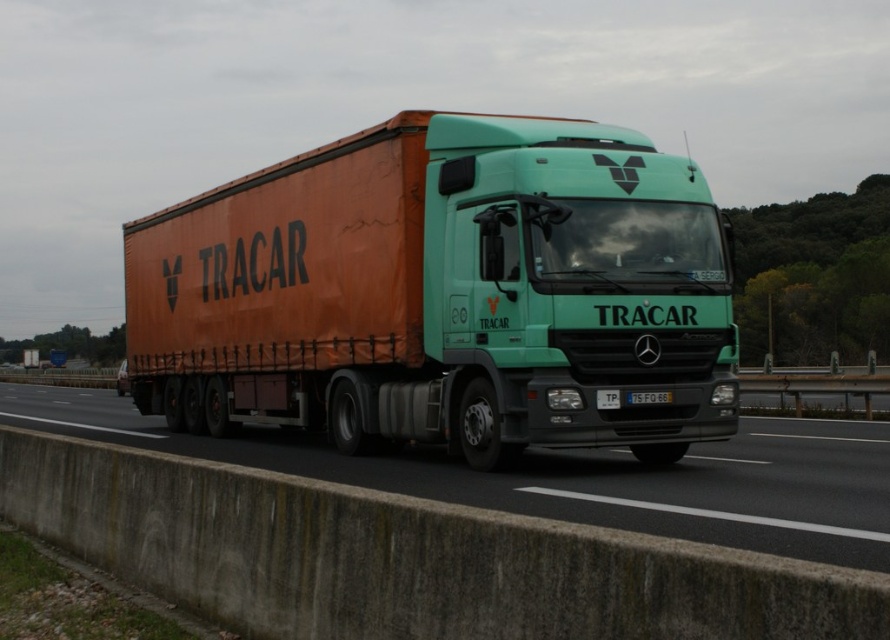
You are a traffic controller monitoring a highway. You observe an orange fabric trailer truck at center. Where is it positioned relative to the highway lanes?

The orange fabric trailer truck at center is located at point 0.459 along the horizontal axis and 0.500 along the vertical axis, placing it centrally on the highway.

You are a delivery driver who needs to secure a package on the orange fabric trailer truck at center. The package must be placed exactly at point (445, 292). Can you confirm the location of the package?

The orange fabric trailer truck at center is located at point (445, 292), so the package should be placed there.

You are a delivery driver who needs to park your truck precisely so that the white plastic license plate at center is exactly 15 feet away from the concrete barrier at lower center. Based on the image, can you confirm if the current position meets this requirement?

The distance between the concrete barrier at lower center and the white plastic license plate at center is 14.98 feet, which is just 0.02 feet less than the required 15 feet. Therefore, the current position does not meet the requirement. The driver needs to adjust the parking position by moving forward slightly to achieve the exact distance.